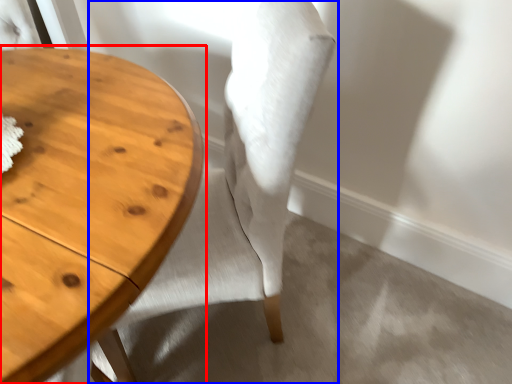
Question: Which object is further to the camera taking this photo, table (highlighted by a red box) or chair (highlighted by a blue box)?

Choices:
 (A) table
 (B) chair

Answer: (B)